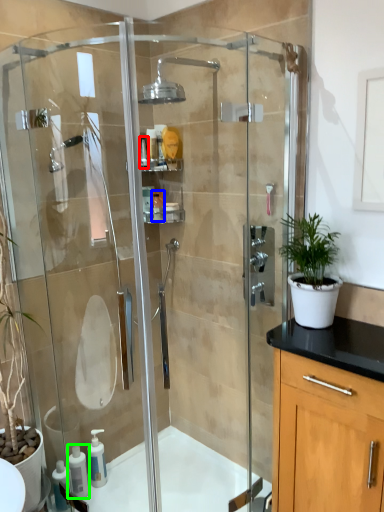
Question: Estimate the real-world distances between objects in this image. Which object is closer to toiletry (highlighted by a red box), toiletry (highlighted by a blue box) or soap dispenser (highlighted by a green box)?

Choices:
 (A) toiletry
 (B) soap dispenser

Answer: (A)